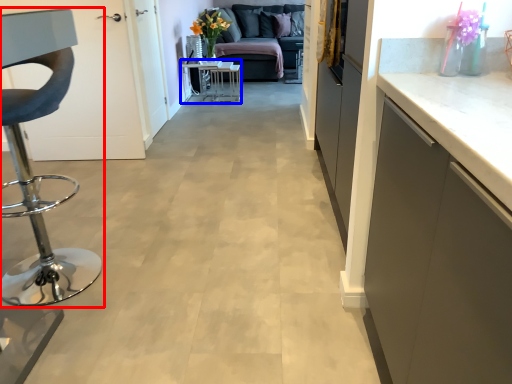
Question: Which object appears farthest to the camera in this image, furniture (highlighted by a red box) or table (highlighted by a blue box)?

Choices:
 (A) furniture
 (B) table

Answer: (B)